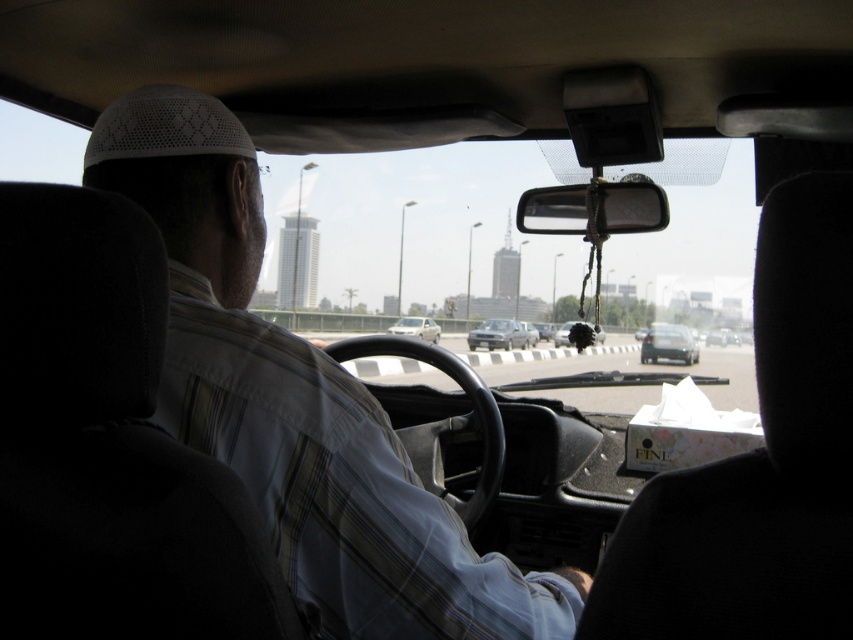
Question: Does matte black car at center have a larger size compared to shiny black car at center?

Choices:
 (A) no
 (B) yes

Answer: (A)

Question: Is light brown striped shirt at center to the right of matte black car at center from the viewer's perspective?

Choices:
 (A) no
 (B) yes

Answer: (A)

Question: Considering the real-world distances, which object is closest to the transparent glass windshield at center?

Choices:
 (A) satin silver sedan at center
 (B) shiny black car at center
 (C) matte black car at center

Answer: (B)

Question: Which object is farther from the camera taking this photo?

Choices:
 (A) transparent glass windshield at center
 (B) light brown striped shirt at center
 (C) matte black car at center

Answer: (C)

Question: Is transparent glass windshield at center to the left of metallic silver sedan at center from the viewer's perspective?

Choices:
 (A) yes
 (B) no

Answer: (B)

Question: Considering the real-world distances, which object is farthest from the satin silver sedan at center?

Choices:
 (A) metallic silver sedan at center
 (B) matte black car at center

Answer: (B)